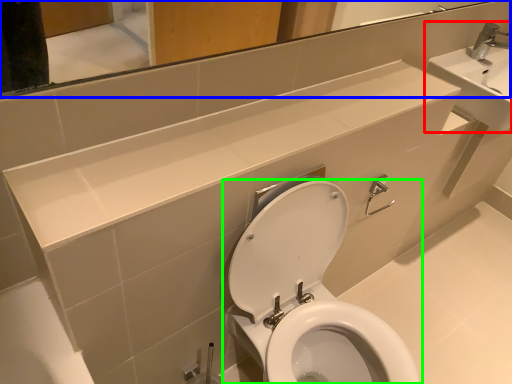
Question: Based on their relative distances, which object is nearer to sink (highlighted by a red box)? Choose from mirror (highlighted by a blue box) and toilet (highlighted by a green box).

Choices:
 (A) mirror
 (B) toilet

Answer: (A)